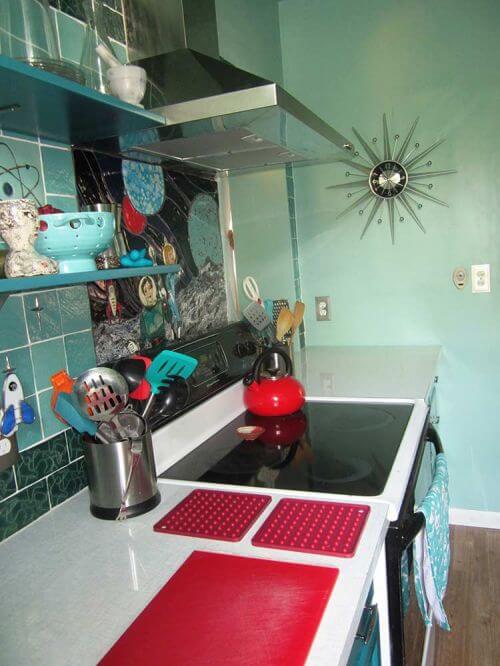
Find the location of a particular element. cutting board is located at coordinates click(244, 647).